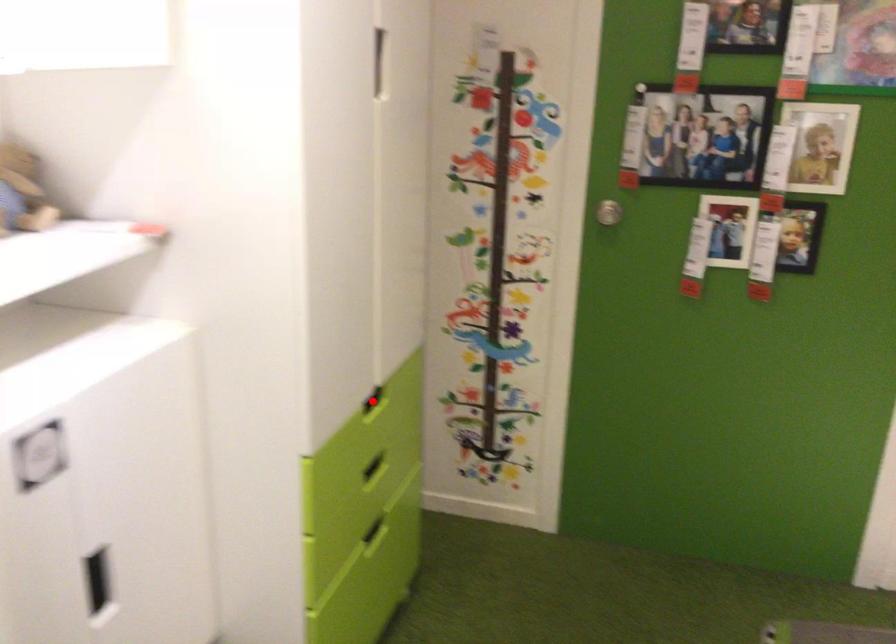
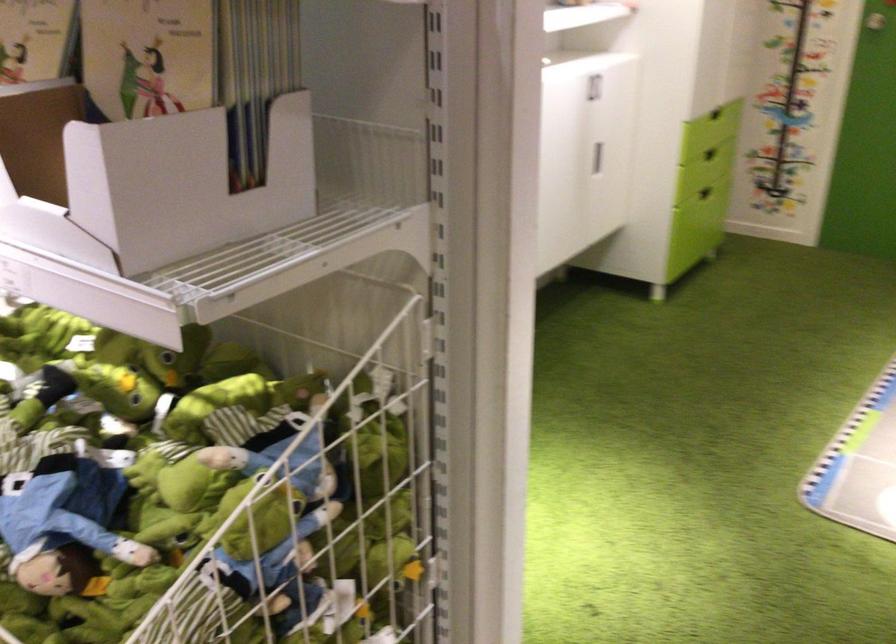
Locate, in the second image, the point that corresponds to the highlighted location in the first image.

(720, 126)